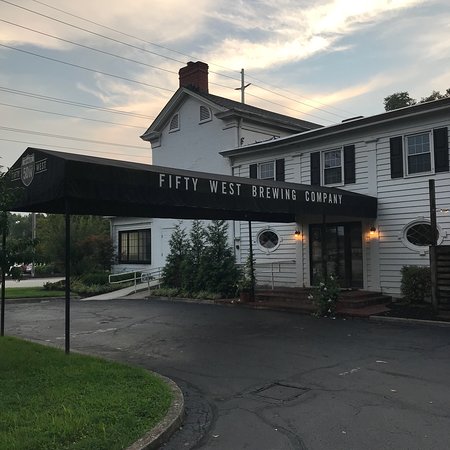
Where is `handrails`? Image resolution: width=450 pixels, height=450 pixels. handrails is located at coordinates (151, 276), (118, 268).